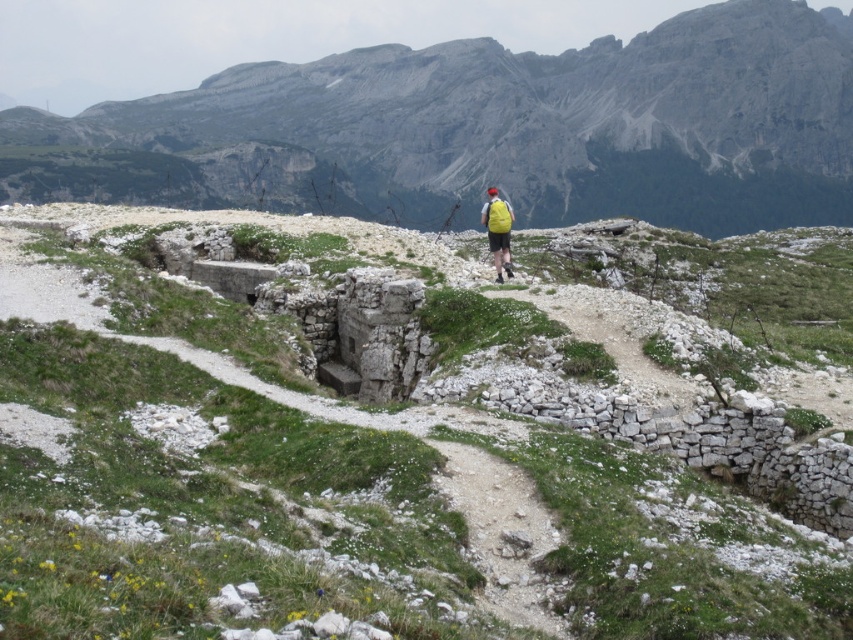
You are a hiker planning to ascend the gray rocky mountain at upper center. You notice the white stone path at center. Which direction should you head to reach the mountain from the path?

The white stone path at center is located below the gray rocky mountain at upper center, so you should head upwards along the white stone path at center to reach the mountain.

Based on the photo, you are a hiker trying to reach the summit. You see a gray rocky mountain at upper center and a yellow fabric backpack at center. Which object is closer to you?

The yellow fabric backpack at center is behind the gray rocky mountain at upper center, so the gray rocky mountain at upper center is closer to you.

You are a hiker planning to climb the gray rocky mountain at upper center. You have a yellow fabric backpack at center with you. Considering the size of the mountain, do you think you need to prepare for a longer hike compared to climbing a smaller mountain?

The gray rocky mountain at upper center has a larger size compared to the yellow fabric backpack at center, which indicates it is bigger than the backpack. Since larger mountains typically require more time and preparation, you should prepare for a longer hike.